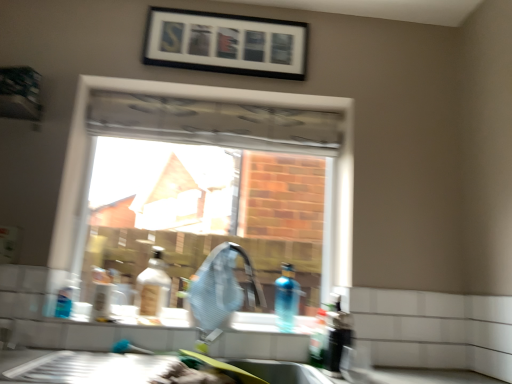
This screenshot has width=512, height=384. Find the location of `clear glass window at center`. clear glass window at center is located at coordinates (222, 101).

Measure the distance between matte plastic bottle at center, the second bottle viewed from the left, and camera.

The distance of matte plastic bottle at center, the second bottle viewed from the left, from camera is 1.67 meters.

Image resolution: width=512 pixels, height=384 pixels. Describe the element at coordinates (67, 298) in the screenshot. I see `translucent plastic bottle at lower left, the fifth bottle when ordered from right to left` at that location.

Identify the location of translucent plastic bottle at sink, acting as the second bottle starting from the right. (318, 339).

Considering the sizes of objects white glossy counter top at lower left and blue translucent bottle at sink, the third bottle from the right, in the image provided, who is wider, white glossy counter top at lower left or blue translucent bottle at sink, the third bottle from the right,?

white glossy counter top at lower left is wider.

Which object is closer to the camera, white glossy counter top at lower left or blue translucent bottle at sink, the 3th bottle positioned from the left?

white glossy counter top at lower left.

Which object is closer to the camera, translucent blue bottle at lower right, the 1th bottle from the right, or white glossy counter top at lower left?

white glossy counter top at lower left is closer to the camera.

Is translucent blue bottle at lower right, the fifth bottle from the left, bigger or smaller than white glossy counter top at lower left?

translucent blue bottle at lower right, the fifth bottle from the left, is smaller than white glossy counter top at lower left.

Which bottle is the 3rd one when counting from the right side of the white glossy counter top at lower left? Please provide its 2D coordinates.

[(336, 336)]

Can you tell me how much translucent blue bottle at lower right, the 1th bottle from the right, and white glossy counter top at lower left differ in facing direction?

The angle between the facing direction of translucent blue bottle at lower right, the 1th bottle from the right, and the facing direction of white glossy counter top at lower left is 1.76 degrees.

Is black matte picture frame at upper center looking in the opposite direction of translucent plastic bottle at sink, acting as the second bottle starting from the right?

black matte picture frame at upper center is not turned away from translucent plastic bottle at sink, acting as the second bottle starting from the right.

Does black matte picture frame at upper center appear on the right side of translucent plastic bottle at sink, acting as the second bottle starting from the right?

No, black matte picture frame at upper center is not to the right of translucent plastic bottle at sink, acting as the second bottle starting from the right.

Looking at their sizes, would you say black matte picture frame at upper center is wider or thinner than translucent plastic bottle at sink, acting as the second bottle starting from the right?

Clearly, black matte picture frame at upper center has less width compared to translucent plastic bottle at sink, acting as the second bottle starting from the right.

Which of these two, black matte picture frame at upper center or translucent plastic bottle at sink, the 4th bottle viewed from the left, is bigger?

With larger size is black matte picture frame at upper center.

Is translucent plastic bottle at sink, the 4th bottle viewed from the left, bigger than black matte picture frame at upper center?

No, translucent plastic bottle at sink, the 4th bottle viewed from the left, is not bigger than black matte picture frame at upper center.

Is translucent plastic bottle at sink, the 4th bottle viewed from the left, inside the boundaries of black matte picture frame at upper center, or outside?

translucent plastic bottle at sink, the 4th bottle viewed from the left, is located beyond the bounds of black matte picture frame at upper center.

From the image's perspective, is translucent plastic bottle at sink, the 4th bottle viewed from the left, located beneath black matte picture frame at upper center?

Yes, from the image's perspective, translucent plastic bottle at sink, the 4th bottle viewed from the left, is below black matte picture frame at upper center.

From the picture: Is translucent plastic bottle at sink, acting as the second bottle starting from the right, further to the viewer compared to black matte picture frame at upper center?

No, it is not.

How different are the orientations of blue translucent bottle at sink, the third bottle from the right, and white glossy counter top at lower left in degrees?

They differ by 1.49 degrees in their facing directions.

Is the surface of blue translucent bottle at sink, the 3th bottle positioned from the left, in direct contact with white glossy counter top at lower left?

No, blue translucent bottle at sink, the 3th bottle positioned from the left, is not next to white glossy counter top at lower left.

Is the position of blue translucent bottle at sink, the third bottle from the right, more distant than that of white glossy counter top at lower left?

Yes, it is behind white glossy counter top at lower left.

Is point (297, 290) less distant than point (287, 371)?

No, it is behind (287, 371).

Are matte plastic bottle at center, which ranks as the 4th bottle in right-to-left order, and translucent plastic bottle at sink, the 4th bottle viewed from the left, making contact?

There is a gap between matte plastic bottle at center, which ranks as the 4th bottle in right-to-left order, and translucent plastic bottle at sink, the 4th bottle viewed from the left.

From the image's perspective, would you say matte plastic bottle at center, the second bottle viewed from the left, is shown under translucent plastic bottle at sink, the 4th bottle viewed from the left?

Actually, matte plastic bottle at center, the second bottle viewed from the left, appears above translucent plastic bottle at sink, the 4th bottle viewed from the left, in the image.

Is translucent plastic bottle at sink, acting as the second bottle starting from the right, inside matte plastic bottle at center, which ranks as the 4th bottle in right-to-left order?

Actually, translucent plastic bottle at sink, acting as the second bottle starting from the right, is outside matte plastic bottle at center, which ranks as the 4th bottle in right-to-left order.

Measure the distance from matte plastic bottle at center, the second bottle viewed from the left, to translucent plastic bottle at sink, acting as the second bottle starting from the right.

matte plastic bottle at center, the second bottle viewed from the left, and translucent plastic bottle at sink, acting as the second bottle starting from the right, are 26.01 inches apart from each other.

The width and height of the screenshot is (512, 384). In order to click on the 5th bottle positioned above the white glossy counter top at lower left (from a real-world perspective) in this screenshot , I will do tap(152, 289).

Between matte plastic bottle at center, the second bottle viewed from the left, and white glossy counter top at lower left, which one has larger size?

white glossy counter top at lower left is bigger.

Where is `counter top beneath the blue translucent bottle at sink, the 3th bottle positioned from the left (from a real-world perspective)`? The image size is (512, 384). counter top beneath the blue translucent bottle at sink, the 3th bottle positioned from the left (from a real-world perspective) is located at coordinates (108, 370).

At what (x,y) coordinates should I click in order to perform the action: click on the 2nd bottle located above the white glossy counter top at lower left (from a real-world perspective). Please return your answer as a coordinate pair (x, y). The width and height of the screenshot is (512, 384). Looking at the image, I should click on (336, 336).

Considering their positions, is matte silver faucet at center positioned closer to matte plastic bottle at center, which ranks as the 4th bottle in right-to-left order, than black matte picture frame at upper center?

matte silver faucet at center is positioned closer to the anchor matte plastic bottle at center, which ranks as the 4th bottle in right-to-left order.

Looking at the image, which one is located closer to clear glass window at center, matte plastic bottle at center, which ranks as the 4th bottle in right-to-left order, or translucent plastic bottle at sink, acting as the second bottle starting from the right?

Based on the image, translucent plastic bottle at sink, acting as the second bottle starting from the right, appears to be nearer to clear glass window at center.

Looking at this image, based on their spatial positions, is matte silver faucet at center or translucent blue bottle at lower right, the 1th bottle from the right, closer to translucent plastic bottle at sink, acting as the second bottle starting from the right?

translucent blue bottle at lower right, the 1th bottle from the right.

Considering their positions, is black matte picture frame at upper center positioned closer to matte plastic bottle at center, the second bottle viewed from the left, than translucent plastic bottle at sink, the 4th bottle viewed from the left?

Among the two, translucent plastic bottle at sink, the 4th bottle viewed from the left, is located nearer to matte plastic bottle at center, the second bottle viewed from the left.

In the scene shown: Which object lies nearer to the anchor point translucent plastic bottle at lower left, marked as the first bottle in a left-to-right arrangement, white glossy counter top at lower left or black matte picture frame at upper center?

white glossy counter top at lower left lies closer to translucent plastic bottle at lower left, marked as the first bottle in a left-to-right arrangement, than the other object.

When comparing their distances from translucent blue bottle at lower right, the fifth bottle from the left, does translucent plastic bottle at lower left, marked as the first bottle in a left-to-right arrangement, or matte plastic bottle at center, which ranks as the 4th bottle in right-to-left order, seem closer?

matte plastic bottle at center, which ranks as the 4th bottle in right-to-left order, is positioned closer to the anchor translucent blue bottle at lower right, the fifth bottle from the left.

Looking at the image, which one is located further to translucent blue bottle at lower right, the 1th bottle from the right, blue translucent bottle at sink, the third bottle from the right, or translucent plastic bottle at sink, the 4th bottle viewed from the left?

blue translucent bottle at sink, the third bottle from the right, is further to translucent blue bottle at lower right, the 1th bottle from the right.

Based on their spatial positions, is matte silver faucet at center or translucent plastic bottle at lower left, the fifth bottle when ordered from right to left, closer to clear glass window at center?

Among the two, matte silver faucet at center is located nearer to clear glass window at center.

You are a GUI agent. You are given a task and a screenshot of the screen. Output one action in this format:
    pyautogui.click(x=<x>, y=<y>)
    Task: Click on the window situated between matte plastic bottle at center, the second bottle viewed from the left, and translucent plastic bottle at sink, acting as the second bottle starting from the right, from left to right
    The image size is (512, 384).
    Given the screenshot: What is the action you would take?
    pyautogui.click(x=222, y=101)

Locate an element on the screen. This screenshot has height=384, width=512. faucet between matte plastic bottle at center, which ranks as the 4th bottle in right-to-left order, and translucent plastic bottle at sink, acting as the second bottle starting from the right, from left to right is located at coordinates (220, 292).

I want to click on counter top located between translucent plastic bottle at lower left, the fifth bottle when ordered from right to left, and translucent blue bottle at lower right, the fifth bottle from the left, in the left-right direction, so [108, 370].

At what (x,y) coordinates should I click in order to perform the action: click on faucet between white glossy counter top at lower left and matte plastic bottle at center, which ranks as the 4th bottle in right-to-left order, in the front-back direction. Please return your answer as a coordinate pair (x, y). Looking at the image, I should click on (220, 292).